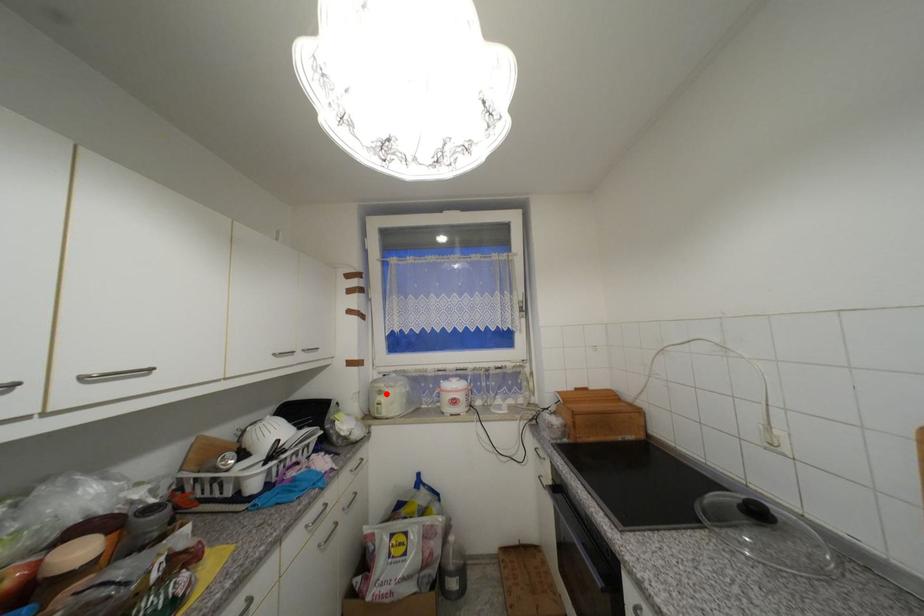
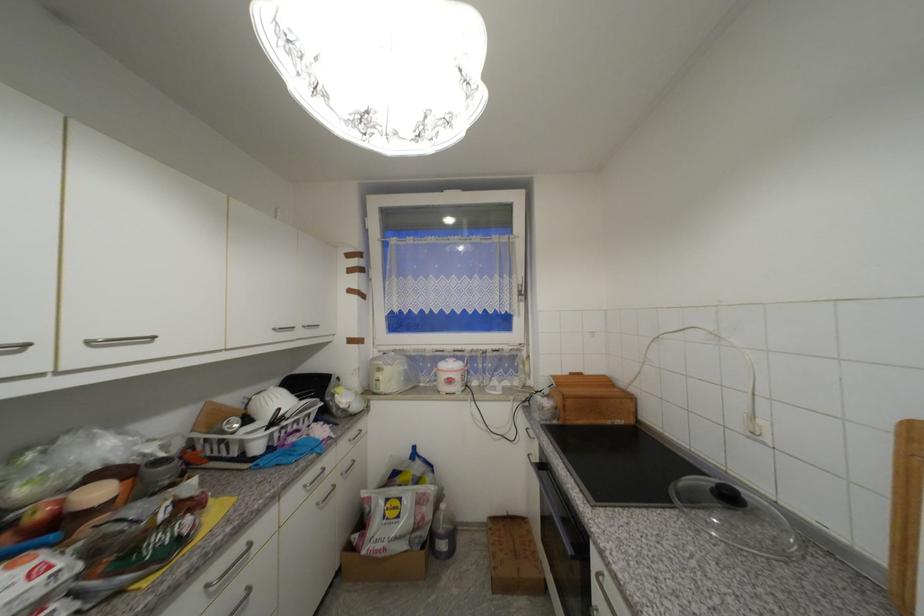
Locate, in the second image, the point that corresponds to the highlighted location in the first image.

(385, 371)